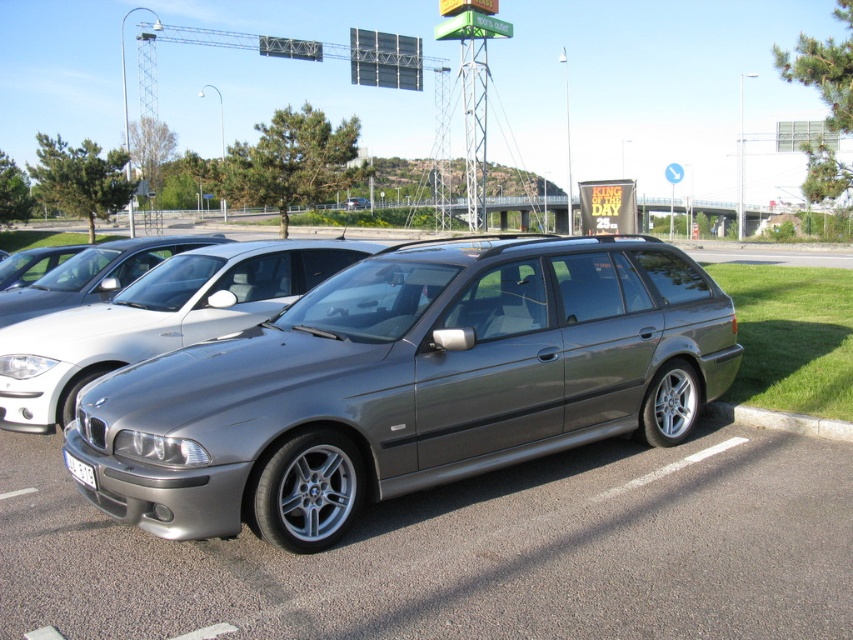
Question: Can you confirm if satin metallic station wagon at center is positioned below gray concrete curb at lower right?

Choices:
 (A) no
 (B) yes

Answer: (A)

Question: Can you confirm if satin metallic station wagon at center is positioned to the right of gray concrete curb at lower right?

Choices:
 (A) yes
 (B) no

Answer: (B)

Question: Which point is farther from the camera taking this photo?

Choices:
 (A) (99, 337)
 (B) (585, 433)
 (C) (85, 467)

Answer: (A)

Question: Estimate the real-world distances between objects in this image. Which object is farther from the satin metallic station wagon at center?

Choices:
 (A) gray concrete curb at lower right
 (B) satin metallic sedan at center
 (C) white plastic license plate at front
 (D) satin silver wagon at center

Answer: (A)

Question: Which of the following is the farthest from the observer?

Choices:
 (A) coord(84,480)
 (B) coord(109,380)

Answer: (B)

Question: Can you confirm if satin metallic sedan at center is wider than satin metallic station wagon at center?

Choices:
 (A) no
 (B) yes

Answer: (B)